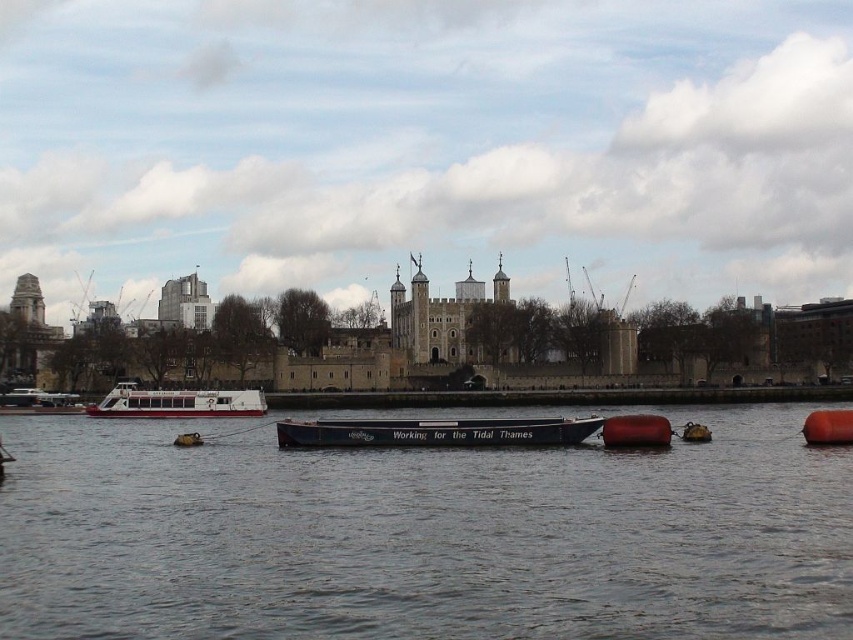
Between black rubber boat at center and white matte boat at left, which one has less height?

white matte boat at left

Does black rubber boat at center appear on the right side of white matte boat at left?

Yes, black rubber boat at center is to the right of white matte boat at left.

Between point (247, 588) and point (51, 412), which one is positioned behind?

Positioned behind is point (51, 412).

Locate an element on the screen. The height and width of the screenshot is (640, 853). black rubber boat at center is located at coordinates (422, 536).

This screenshot has height=640, width=853. I want to click on black rubber boat at center, so click(422, 536).

Which is behind, point (512, 426) or point (805, 424)?

Point (805, 424)

Is black matte boat at center closer to the viewer compared to orange rubber buoy at lower right?

No, it is behind orange rubber buoy at lower right.

From the picture: Measure the distance between point (369, 429) and camera.

Point (369, 429) and camera are 82.90 meters apart.

Find the location of `black matte boat at center`. black matte boat at center is located at coordinates (434, 433).